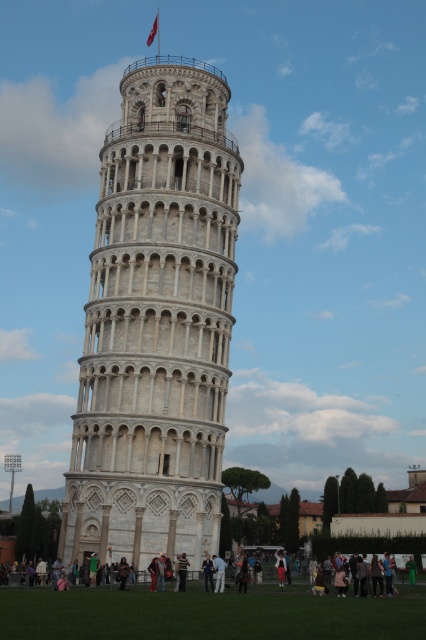
Question: Is white stone tower at center above light brown wooden bench at lower center?

Choices:
 (A) yes
 (B) no

Answer: (A)

Question: Is white stone tower at center wider than striped sweater at center?

Choices:
 (A) no
 (B) yes

Answer: (B)

Question: Is light brown wooden bench at lower center wider than striped sweater at center?

Choices:
 (A) yes
 (B) no

Answer: (A)

Question: Based on their relative distances, which object is farther from the white stone tower at center?

Choices:
 (A) light brown wooden bench at lower center
 (B) striped sweater at center

Answer: (B)

Question: Among these objects, which one is nearest to the camera?

Choices:
 (A) striped sweater at center
 (B) light brown wooden bench at lower center

Answer: (A)

Question: Which of the following is the closest to the observer?

Choices:
 (A) light brown wooden bench at lower center
 (B) white stone tower at center
 (C) striped sweater at center

Answer: (C)